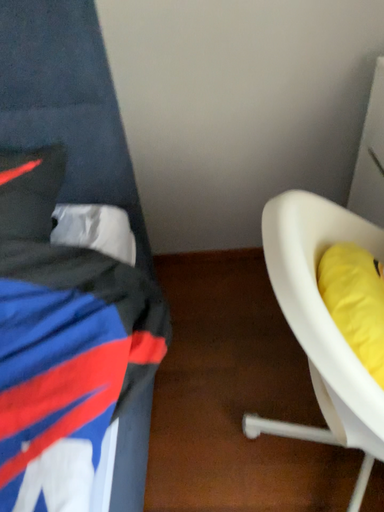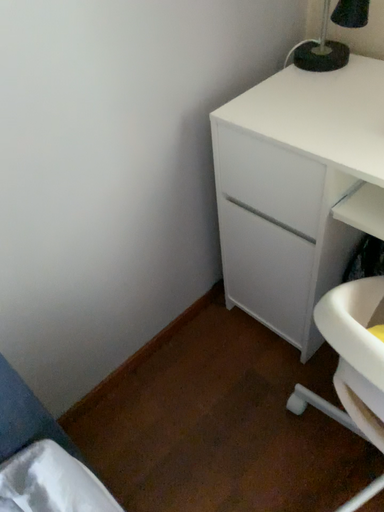
Question: Which way did the camera rotate in the video?

Choices:
 (A) rotated left
 (B) rotated right

Answer: (B)